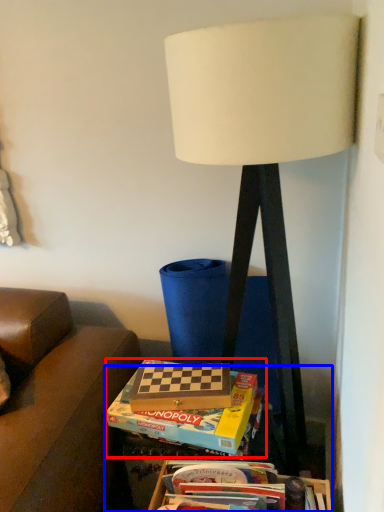
Question: Which of the following is the farthest to the observer, box (highlighted by a red box) or table (highlighted by a blue box)?

Choices:
 (A) box
 (B) table

Answer: (B)